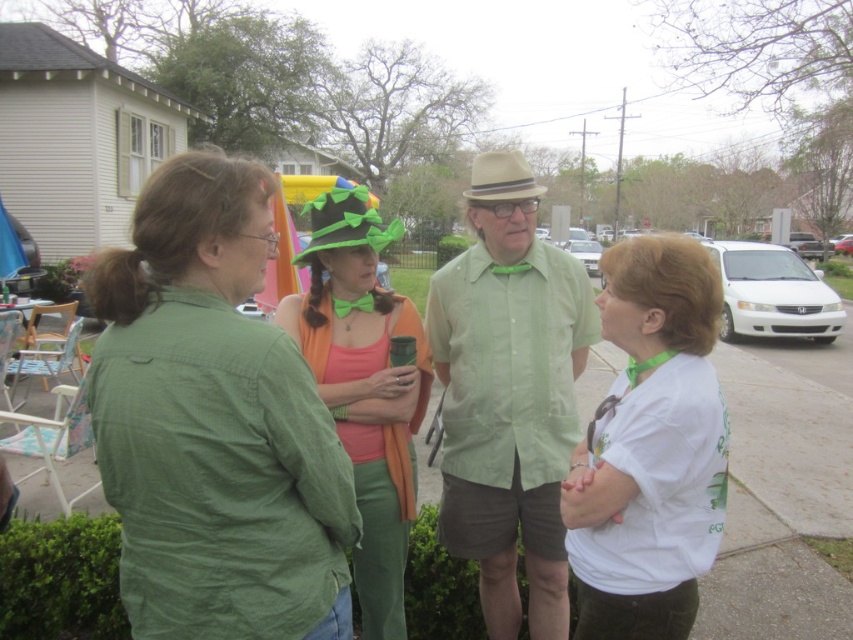
Question: Is green matte shirt at left positioned at the back of white matte shirt at center?

Choices:
 (A) yes
 (B) no

Answer: (B)

Question: Which point is closer to the camera taking this photo?

Choices:
 (A) (228, 216)
 (B) (682, 413)

Answer: (A)

Question: Does green matte shirt at left appear over green felt hat at center?

Choices:
 (A) yes
 (B) no

Answer: (A)

Question: Does green matte shirt at left have a larger size compared to green felt hat at center?

Choices:
 (A) no
 (B) yes

Answer: (A)

Question: Estimate the real-world distances between objects in this image. Which object is closer to the green cotton shirt at center?

Choices:
 (A) white matte shirt at center
 (B) green matte shirt at left
 (C) green felt hat at center

Answer: (C)

Question: Which object is closer to the camera taking this photo?

Choices:
 (A) green felt hat at center
 (B) white matte shirt at center
 (C) green cotton shirt at center
 (D) green matte shirt at left

Answer: (D)